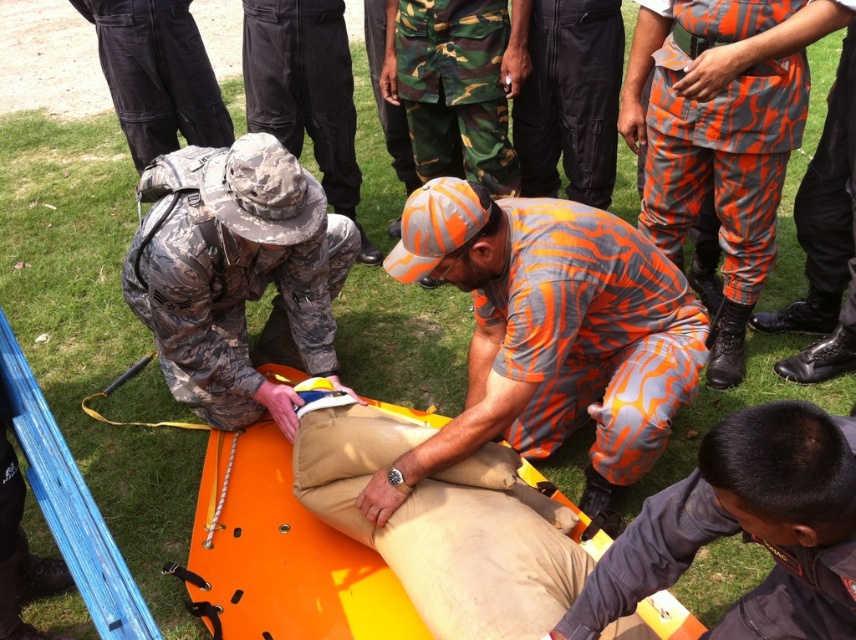
Does camouflage fabric hat at upper left appear on the left side of orange camouflage pants at right?

Indeed, camouflage fabric hat at upper left is positioned on the left side of orange camouflage pants at right.

Describe the element at coordinates (305, 92) in the screenshot. I see `camouflage fabric hat at upper left` at that location.

Is point (304, 96) less distant than point (831, 118)?

That is False.

Where is `camouflage fabric hat at upper left`? camouflage fabric hat at upper left is located at coordinates (305, 92).

Who is more forward, (658,4) or (839,176)?

Positioned in front is point (658,4).

Who is higher up, orange camouflage pants at center or orange camouflage pants at right?

orange camouflage pants at right is higher up.

Is point (654, 205) farther from camera compared to point (841, 58)?

Yes.

Find the location of a particular element. This screenshot has width=856, height=640. orange camouflage pants at center is located at coordinates (721, 131).

Does camouflage fabric uniform at left appear on the left side of orange camouflage pants at right?

Indeed, camouflage fabric uniform at left is positioned on the left side of orange camouflage pants at right.

Is point (191, 230) closer to camera compared to point (851, 10)?

That is False.

Where is `camouflage fabric uniform at left`? The width and height of the screenshot is (856, 640). camouflage fabric uniform at left is located at coordinates (235, 273).